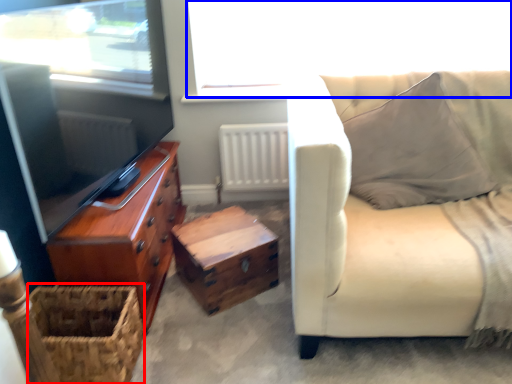
Question: Which of the following is the closest to the observer, basket (highlighted by a red box) or window screen (highlighted by a blue box)?

Choices:
 (A) basket
 (B) window screen

Answer: (A)